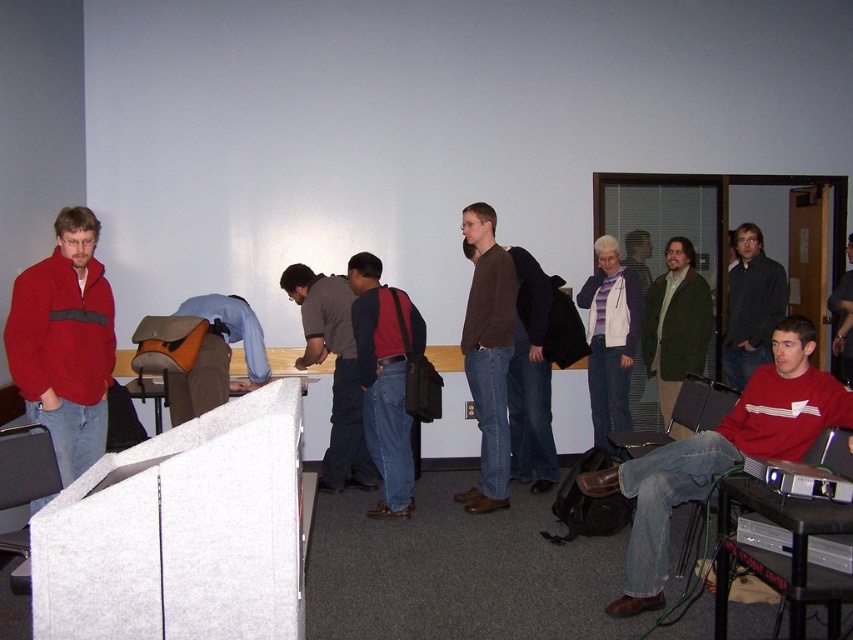
Measure the distance between matte fleece jacket at left and denim jacket at left.

matte fleece jacket at left and denim jacket at left are 30.59 inches apart from each other.

Which is more to the right, matte fleece jacket at left or denim jacket at left?

denim jacket at left is more to the right.

Locate an element on the screen. The image size is (853, 640). matte fleece jacket at left is located at coordinates (65, 342).

Identify the location of matte fleece jacket at left. (65, 342).

Can you confirm if black plastic projector at lower right is positioned below matte brown jacket at center?

Indeed, black plastic projector at lower right is positioned under matte brown jacket at center.

Describe the element at coordinates (805, 460) in the screenshot. The width and height of the screenshot is (853, 640). I see `black plastic projector at lower right` at that location.

Is point (828, 467) positioned behind point (631, 250)?

No, (828, 467) is in front of (631, 250).

Identify the location of black plastic projector at lower right. (805, 460).

Does brown matte sweater at center have a greater width compared to dark gray fabric shirt at center?

No.

What do you see at coordinates (488, 355) in the screenshot? This screenshot has height=640, width=853. I see `brown matte sweater at center` at bounding box center [488, 355].

Who is more forward, [485,225] or [322,477]?

Positioned in front is point [485,225].

You are a GUI agent. You are given a task and a screenshot of the screen. Output one action in this format:
    pyautogui.click(x=<x>, y=<y>)
    Task: Click on the brown matte sweater at center
    This screenshot has width=853, height=640.
    Given the screenshot: What is the action you would take?
    pyautogui.click(x=488, y=355)